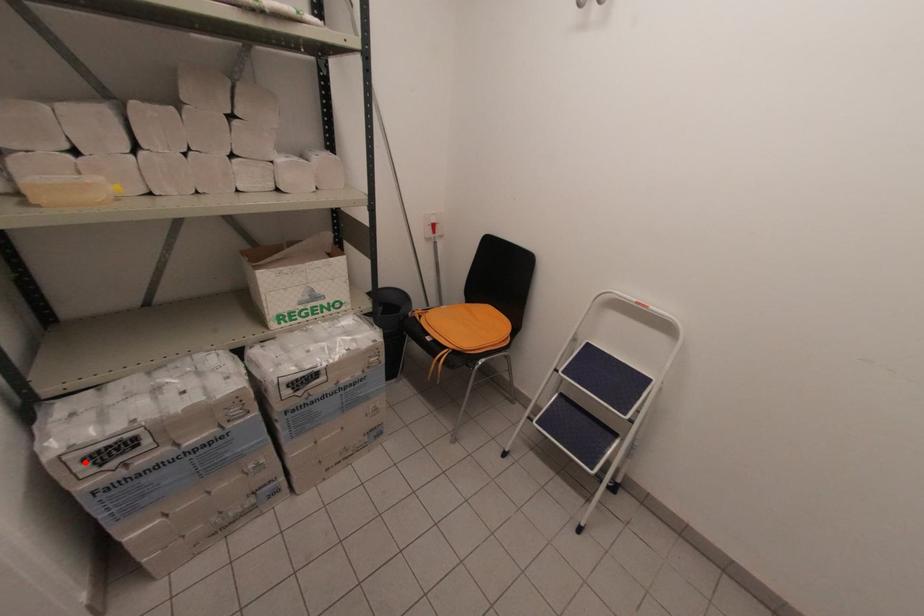
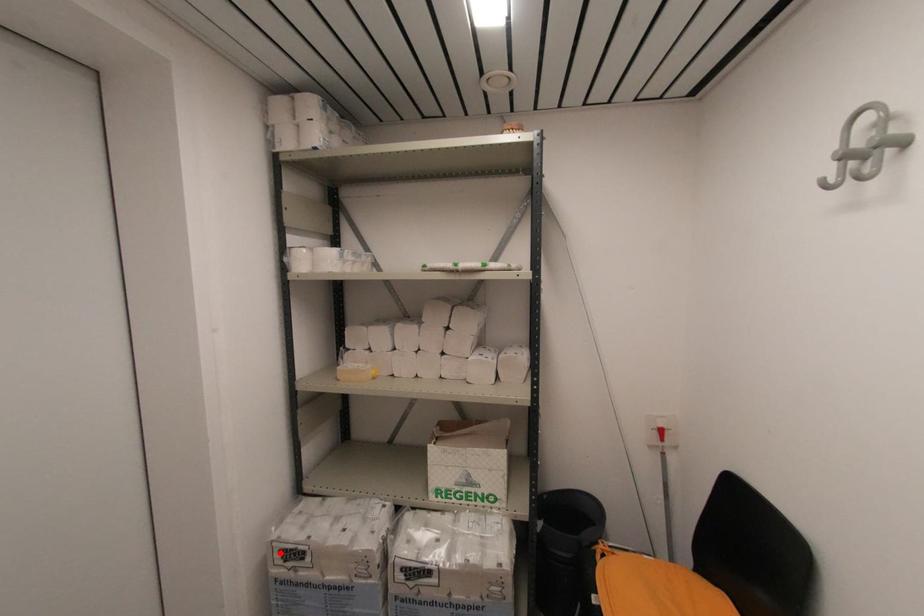
I am providing you with two images of the same scene from different viewpoints. A red point is marked on the first image and another point is marked on the second image. Are the points marked in image1 and image2 representing the same 3D position?

Yes